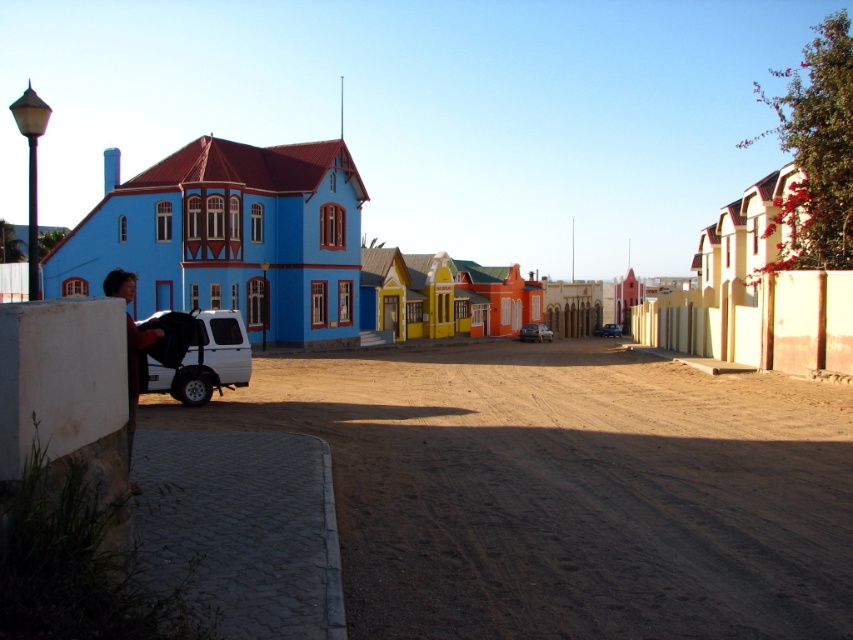
You are a delivery person trying to navigate through the street. You see a black fabric baby carriage at lower left and a matte black car at center. Which object is closer to you?

The black fabric baby carriage at lower left is closer to you because it is in front of the matte black car at center.

You are a delivery driver who needs to park your metallic silver car at center on the brown sandy dirt track at lower left. Is there enough space for the car to move onto the track?

The brown sandy dirt track at lower left is positioned on the left side of metallic silver car at center. Since the track is already to the left of the car, there might not be enough space for the car to maneuver onto the track without moving further left, but the description does not provide specific measurements about the width or length of the track or the car. Therefore, it is uncertain if there is sufficient space based on the given information.